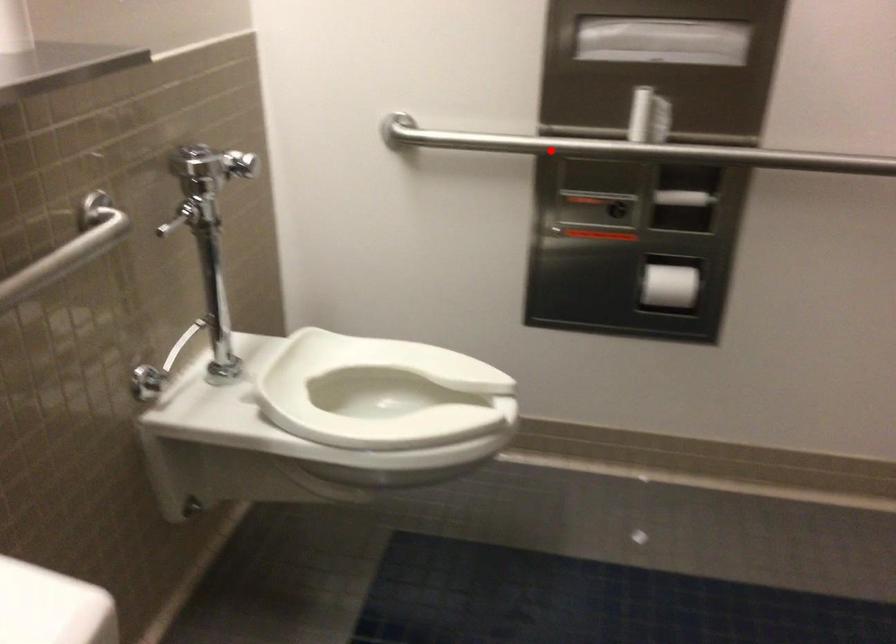
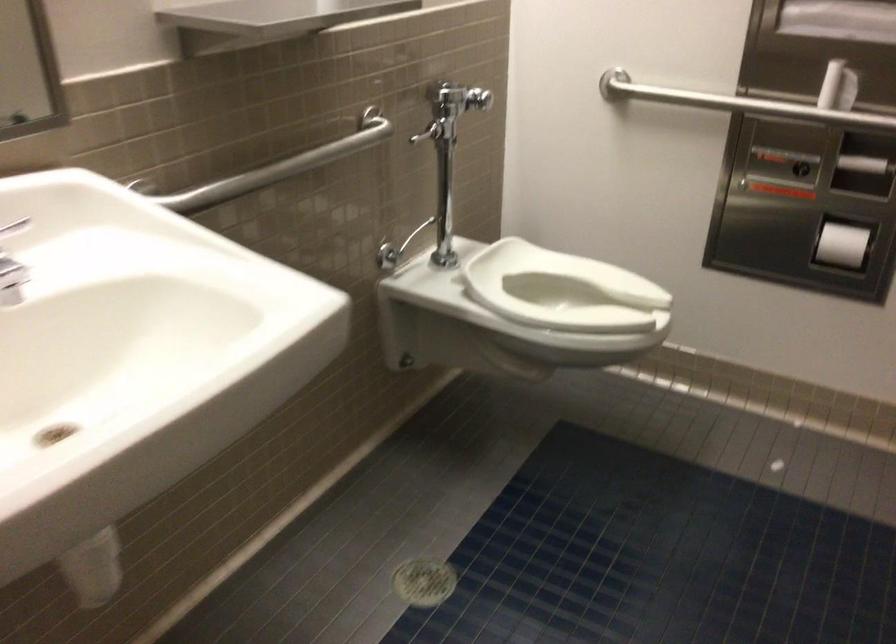
Locate, in the second image, the point that corresponds to the highlighted location in the first image.

(739, 104)